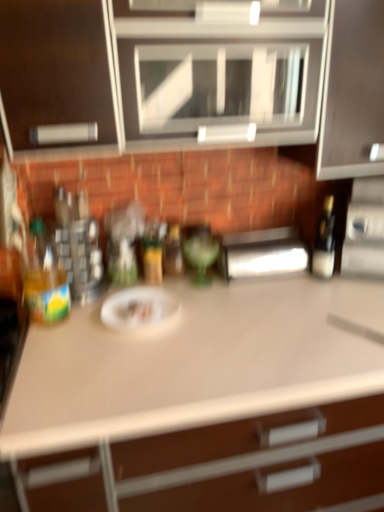
Image resolution: width=384 pixels, height=512 pixels. What do you see at coordinates (173, 252) in the screenshot? I see `green glass bottle at center, the 2th bottle positioned from the right` at bounding box center [173, 252].

This screenshot has width=384, height=512. Find the location of `satin silver paper towel dispenser at center, the 2th appliance positioned from the right`. satin silver paper towel dispenser at center, the 2th appliance positioned from the right is located at coordinates (262, 253).

This screenshot has height=512, width=384. In order to click on matte white cabinet at upper center in this screenshot , I will do `click(195, 78)`.

The image size is (384, 512). In order to click on satin silver toaster at right, marked as the 1th appliance in a right-to-left arrangement in this screenshot , I will do `click(365, 229)`.

Measure the distance between point (150, 225) and camera.

A distance of 1.60 meters exists between point (150, 225) and camera.

Identify the location of translucent plastic bottle at left, which appears as the 4th bottle when viewed from the right. (46, 281).

Measure the distance from satin silver paper towel dispenser at center, arranged as the 1th appliance when viewed from the left, to translucent plastic bottle at left, positioned as the 1th bottle in left-to-right order.

25.97 inches.

Considering the sizes of satin silver paper towel dispenser at center, the 2th appliance positioned from the right, and translucent plastic bottle at left, positioned as the 1th bottle in left-to-right order, in the image, is satin silver paper towel dispenser at center, the 2th appliance positioned from the right, wider or thinner than translucent plastic bottle at left, positioned as the 1th bottle in left-to-right order,?

satin silver paper towel dispenser at center, the 2th appliance positioned from the right, is wider than translucent plastic bottle at left, positioned as the 1th bottle in left-to-right order.

Does satin silver paper towel dispenser at center, arranged as the 1th appliance when viewed from the left, have a lesser height compared to translucent plastic bottle at left, positioned as the 1th bottle in left-to-right order?

Yes.

Is satin silver paper towel dispenser at center, the 2th appliance positioned from the right, located outside translucent plastic bottle at left, positioned as the 1th bottle in left-to-right order?

That's correct, satin silver paper towel dispenser at center, the 2th appliance positioned from the right, is outside of translucent plastic bottle at left, positioned as the 1th bottle in left-to-right order.

Is white matte countertop at center surrounded by white matte paper plate at center?

Actually, white matte countertop at center is outside white matte paper plate at center.

How much distance is there between white matte paper plate at center and white matte countertop at center?

The distance of white matte paper plate at center from white matte countertop at center is 12.52 inches.

From a real-world perspective, does white matte paper plate at center stand above white matte countertop at center?

Yes, from a real-world perspective, white matte paper plate at center is above white matte countertop at center.

How different are the orientations of white matte paper plate at center and white matte countertop at center in degrees?

The angle between the facing direction of white matte paper plate at center and the facing direction of white matte countertop at center is 0.000125 degrees.

Choose the correct answer: Is white matte countertop at center inside satin silver paper towel dispenser at center, the 2th appliance positioned from the right, or outside it?

The correct answer is: outside.

In the scene shown: Can you tell me how much white matte countertop at center and satin silver paper towel dispenser at center, the 2th appliance positioned from the right, differ in facing direction?

The angle between the facing direction of white matte countertop at center and the facing direction of satin silver paper towel dispenser at center, the 2th appliance positioned from the right, is 1.54 degrees.

Consider the image. From a real-world perspective, is white matte countertop at center over satin silver paper towel dispenser at center, arranged as the 1th appliance when viewed from the left?

No, from a real-world perspective, white matte countertop at center is not over satin silver paper towel dispenser at center, arranged as the 1th appliance when viewed from the left

Would you say white matte countertop at center is a long distance from satin silver paper towel dispenser at center, the 2th appliance positioned from the right?

No, white matte countertop at center is not far from satin silver paper towel dispenser at center, the 2th appliance positioned from the right.

Relative to translucent glass bottle at center, which is the 2th bottle from left to right, is matte black bottle at right, acting as the 1th bottle starting from the right, in front or behind?

Visually, matte black bottle at right, acting as the 1th bottle starting from the right, is located in front of translucent glass bottle at center, which is the 2th bottle from left to right.

From a real-world perspective, is matte black bottle at right, positioned as the fourth bottle in left-to-right order, physically located above or below translucent glass bottle at center, which is counted as the 3th bottle, starting from the right?

In terms of real-world spatial position, matte black bottle at right, positioned as the fourth bottle in left-to-right order, is above translucent glass bottle at center, which is counted as the 3th bottle, starting from the right.

Is matte black bottle at right, positioned as the fourth bottle in left-to-right order, wider or thinner than translucent glass bottle at center, which is counted as the 3th bottle, starting from the right?

Clearly, matte black bottle at right, positioned as the fourth bottle in left-to-right order, has less width compared to translucent glass bottle at center, which is counted as the 3th bottle, starting from the right.

Is white matte countertop at center positioned with its back to translucent plastic bottle at left, positioned as the 1th bottle in left-to-right order?

white matte countertop at center is not turned away from translucent plastic bottle at left, positioned as the 1th bottle in left-to-right order.

Which of these two, white matte countertop at center or translucent plastic bottle at left, positioned as the 1th bottle in left-to-right order, stands shorter?

With less height is translucent plastic bottle at left, positioned as the 1th bottle in left-to-right order.

From the image's perspective, which one is positioned higher, white matte countertop at center or translucent plastic bottle at left, positioned as the 1th bottle in left-to-right order?

translucent plastic bottle at left, positioned as the 1th bottle in left-to-right order, from the image's perspective.

Identify the location of the 2nd appliance to the right of the green glass bottle at center, the 2th bottle positioned from the right, starting your count from the anchor. Image resolution: width=384 pixels, height=512 pixels. (365, 229).

In the scene shown: Could you tell me if green glass bottle at center, the 2th bottle positioned from the right, is facing satin silver toaster at right, which ranks as the 2th appliance in left-to-right order?

No, green glass bottle at center, the 2th bottle positioned from the right, is not facing towards satin silver toaster at right, which ranks as the 2th appliance in left-to-right order.

Is green glass bottle at center, the 2th bottle positioned from the right, next to satin silver toaster at right, which ranks as the 2th appliance in left-to-right order, and touching it?

No, green glass bottle at center, the 2th bottle positioned from the right, is not beside satin silver toaster at right, which ranks as the 2th appliance in left-to-right order.

Would you say green glass bottle at center, the 2th bottle positioned from the right, is outside satin silver toaster at right, marked as the 1th appliance in a right-to-left arrangement?

That's correct, green glass bottle at center, the 2th bottle positioned from the right, is outside of satin silver toaster at right, marked as the 1th appliance in a right-to-left arrangement.

From a real-world perspective, between satin silver paper towel dispenser at center, the 2th appliance positioned from the right, and satin silver toaster at right, marked as the 1th appliance in a right-to-left arrangement, who is vertically lower?

In real-world perspective, satin silver paper towel dispenser at center, the 2th appliance positioned from the right, is lower.

Is satin silver paper towel dispenser at center, the 2th appliance positioned from the right, inside the boundaries of satin silver toaster at right, which ranks as the 2th appliance in left-to-right order, or outside?

satin silver paper towel dispenser at center, the 2th appliance positioned from the right, is spatially situated outside satin silver toaster at right, which ranks as the 2th appliance in left-to-right order.

I want to click on appliance on the right of the satin silver paper towel dispenser at center, the 2th appliance positioned from the right, so click(x=365, y=229).

From their relative heights in the image, would you say satin silver paper towel dispenser at center, arranged as the 1th appliance when viewed from the left, is taller or shorter than satin silver toaster at right, which ranks as the 2th appliance in left-to-right order?

Considering their sizes, satin silver paper towel dispenser at center, arranged as the 1th appliance when viewed from the left, has less height than satin silver toaster at right, which ranks as the 2th appliance in left-to-right order.

Identify the location of appliance below the translucent plastic bottle at left, which appears as the 4th bottle when viewed from the right (from a real-world perspective). (262, 253).

Image resolution: width=384 pixels, height=512 pixels. Identify the location of paper plate above the white matte countertop at center (from the image's perspective). (140, 309).

From the image, which object appears to be farther from matte white cabinet at upper center, green glass bottle at center, which appears as the 3th bottle when viewed from the left, or matte black bottle at right, positioned as the fourth bottle in left-to-right order?

Among the two, green glass bottle at center, which appears as the 3th bottle when viewed from the left, is located further to matte white cabinet at upper center.

From the image, which object appears to be farther from white matte countertop at center, translucent plastic bottle at left, positioned as the 1th bottle in left-to-right order, or translucent glass bottle at center, which is the 2th bottle from left to right?

The object further to white matte countertop at center is translucent glass bottle at center, which is the 2th bottle from left to right.

When comparing their distances from satin silver toaster at right, marked as the 1th appliance in a right-to-left arrangement, does white matte paper plate at center or translucent glass bottle at center, which is counted as the 3th bottle, starting from the right, seem further?

Based on the image, white matte paper plate at center appears to be further to satin silver toaster at right, marked as the 1th appliance in a right-to-left arrangement.

Based on their spatial positions, is white matte countertop at center or satin silver paper towel dispenser at center, arranged as the 1th appliance when viewed from the left, closer to white matte paper plate at center?

white matte countertop at center is closer to white matte paper plate at center.

Estimate the real-world distances between objects in this image. Which object is closer to matte white cabinet at upper center, white matte countertop at center or green glass bottle at center, which appears as the 3th bottle when viewed from the left?

Based on the image, green glass bottle at center, which appears as the 3th bottle when viewed from the left, appears to be nearer to matte white cabinet at upper center.

When comparing their distances from translucent glass bottle at center, which is the 2th bottle from left to right, does white matte paper plate at center or matte black bottle at right, positioned as the fourth bottle in left-to-right order, seem closer?

white matte paper plate at center is positioned closer to the anchor translucent glass bottle at center, which is the 2th bottle from left to right.

From the image, which object appears to be farther from satin silver paper towel dispenser at center, arranged as the 1th appliance when viewed from the left, white matte countertop at center or white matte paper plate at center?

white matte countertop at center.

Estimate the real-world distances between objects in this image. Which object is closer to translucent plastic bottle at left, positioned as the 1th bottle in left-to-right order, matte white cabinet at upper center or satin silver paper towel dispenser at center, arranged as the 1th appliance when viewed from the left?

The object closer to translucent plastic bottle at left, positioned as the 1th bottle in left-to-right order, is satin silver paper towel dispenser at center, arranged as the 1th appliance when viewed from the left.

This screenshot has width=384, height=512. Find the location of `cabinetry between translucent plastic bottle at left, which appears as the 4th bottle when viewed from the right, and matte black bottle at right, acting as the 1th bottle starting from the right`. cabinetry between translucent plastic bottle at left, which appears as the 4th bottle when viewed from the right, and matte black bottle at right, acting as the 1th bottle starting from the right is located at coordinates (195, 78).

What are the coordinates of `appliance between green glass bottle at center, the 2th bottle positioned from the right, and matte black bottle at right, acting as the 1th bottle starting from the right` in the screenshot? It's located at (262, 253).

Identify the location of countertop between white matte paper plate at center and matte black bottle at right, acting as the 1th bottle starting from the right. This screenshot has height=512, width=384. (207, 402).

Locate an element on the screen. The height and width of the screenshot is (512, 384). bottle located between matte white cabinet at upper center and satin silver toaster at right, which ranks as the 2th appliance in left-to-right order, in the left-right direction is located at coordinates (325, 242).